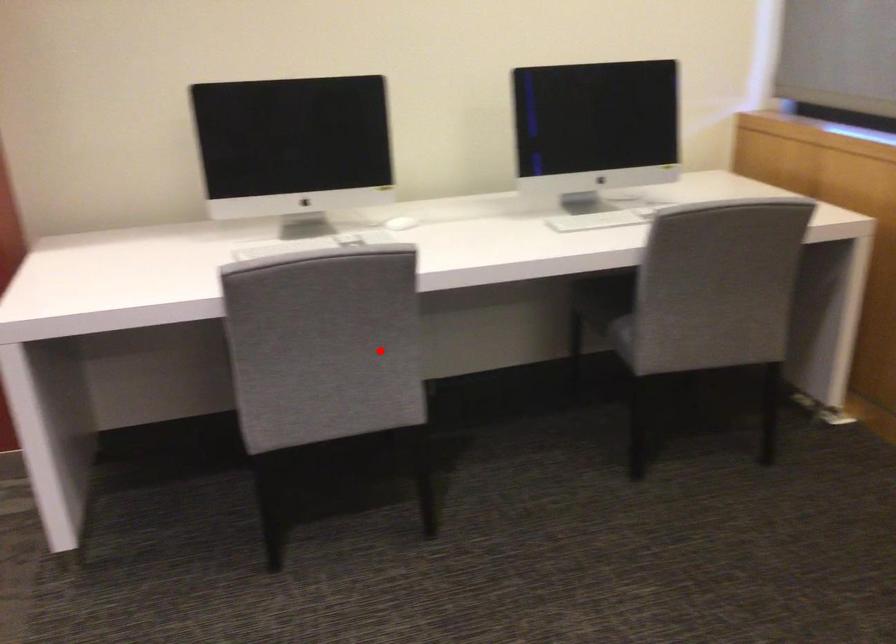
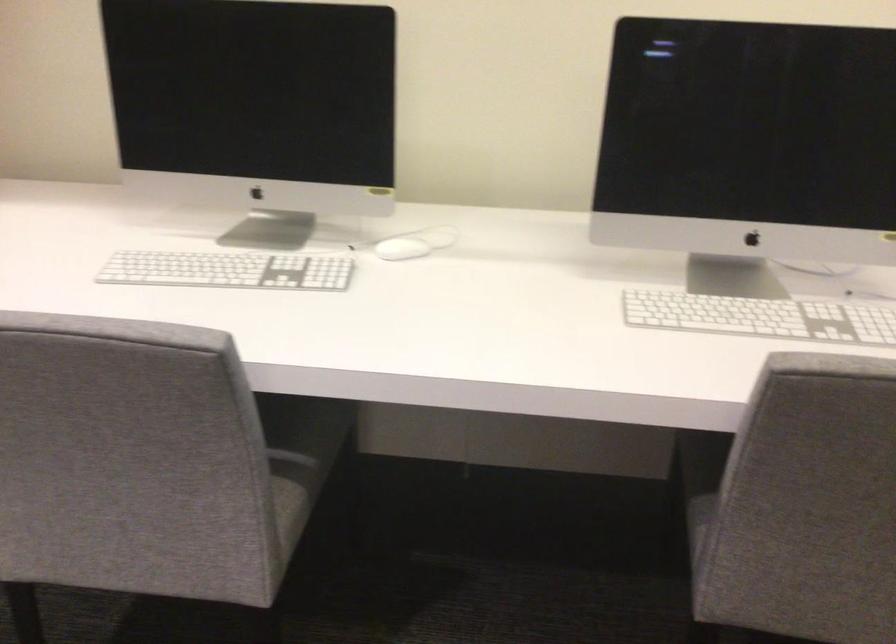
Question: I am providing you with two images of the same scene from different viewpoints. Given a red point in image1, look at the same physical point in image2. Is it:

Choices:
 (A) Closer to the viewpoint
 (B) Farther from the viewpoint

Answer: (A)